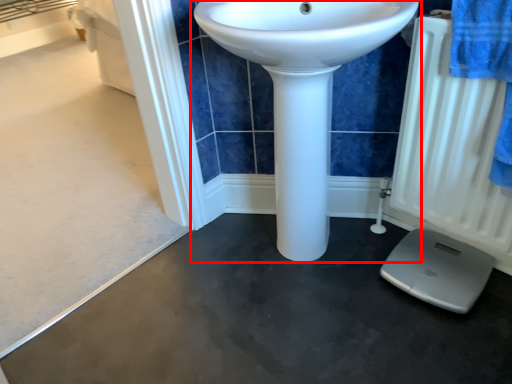
Question: From the image, what is the correct spatial relationship of sink (annotated by the red box) in relation to radiator?

Choices:
 (A) left
 (B) right

Answer: (A)